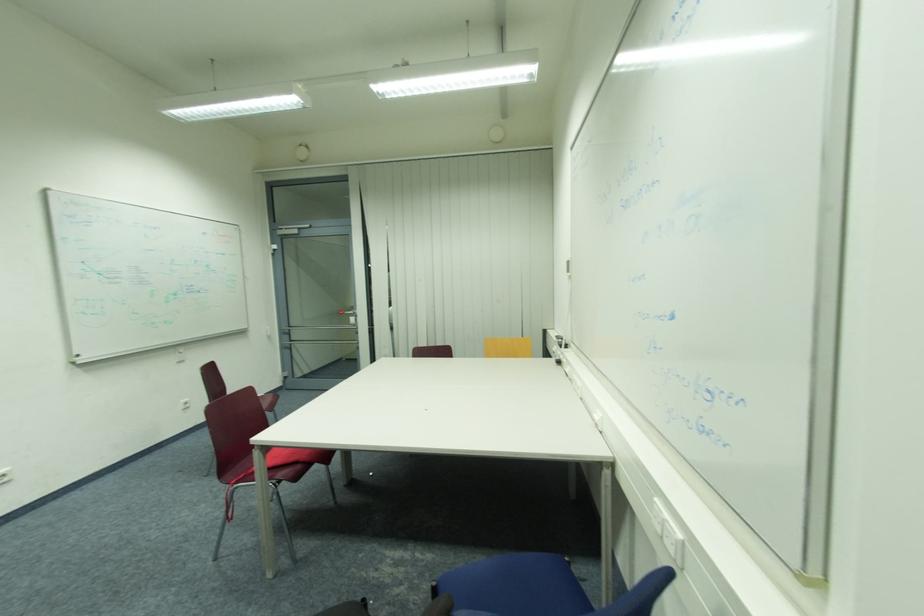
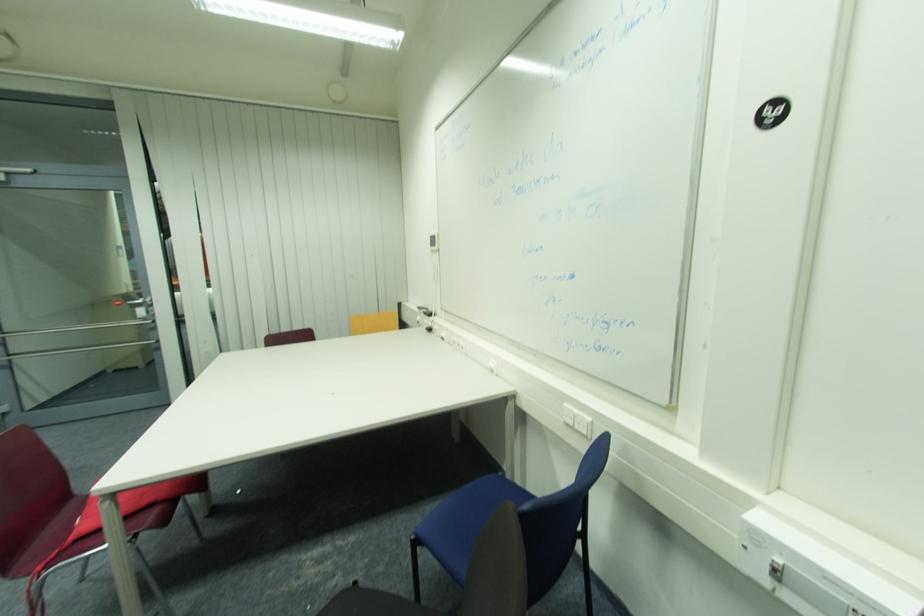
Question: The camera is either moving clockwise (left) or counter-clockwise (right) around the object. The first image is from the beginning of the video and the second image is from the end. Is the camera moving left or right when shooting the video?

Choices:
 (A) Left
 (B) Right

Answer: (A)